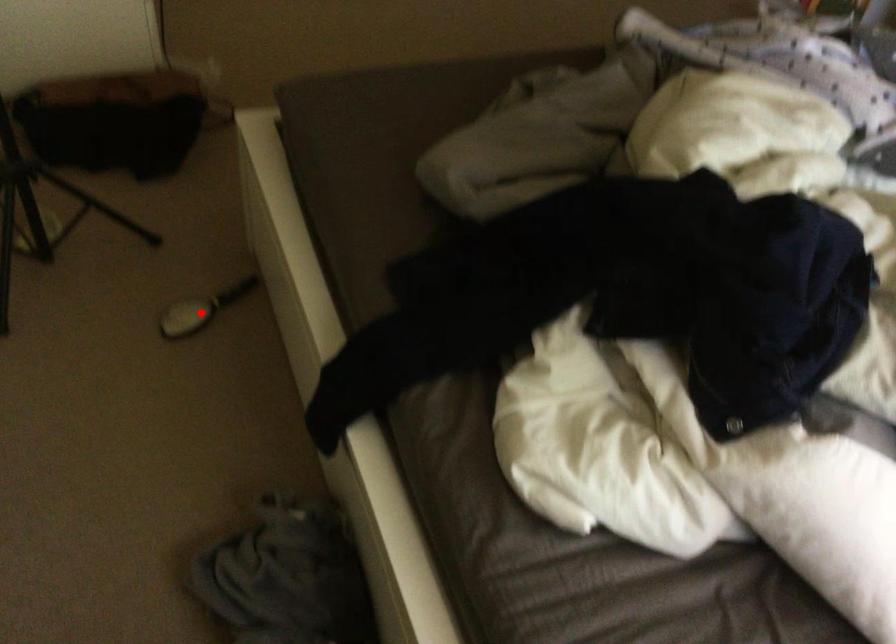
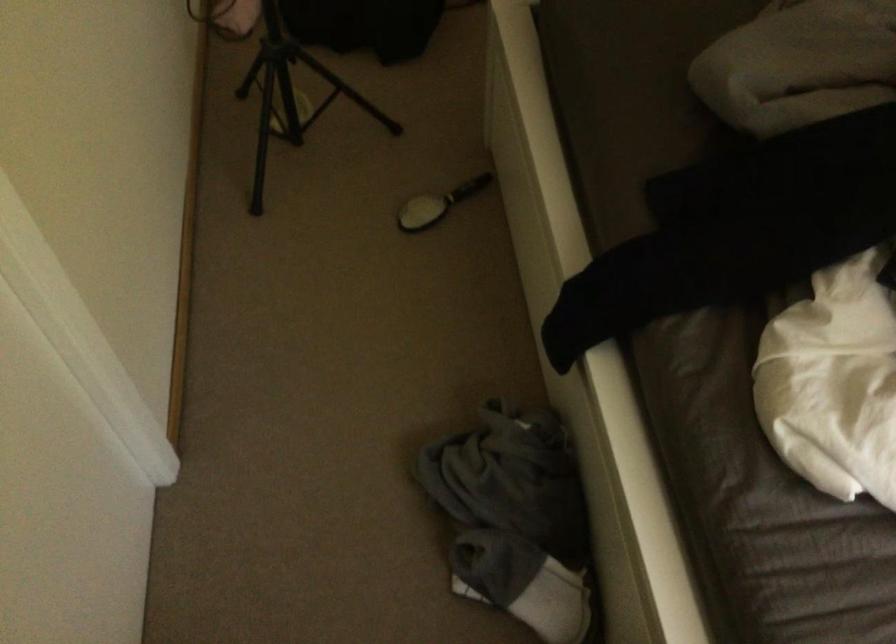
Find the pixel in the second image that matches the highlighted location in the first image.

(437, 204)